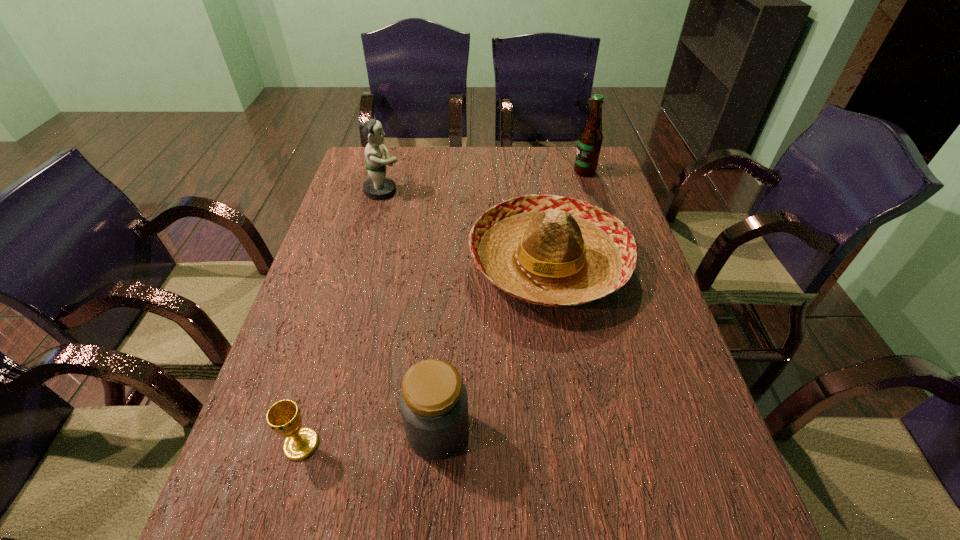
This screenshot has height=540, width=960. Find the location of `vacant space located 0.300m on the back of the sombrero`. vacant space located 0.300m on the back of the sombrero is located at coordinates (533, 164).

Find the location of a particular element. This screenshot has width=960, height=540. vacant region located 0.400m on the right of the chalice is located at coordinates (526, 444).

Find the location of a particular element. The height and width of the screenshot is (540, 960). beer bottle that is at the far edge is located at coordinates (590, 139).

Where is `figurine present at the far edge`? This screenshot has height=540, width=960. figurine present at the far edge is located at coordinates (378, 186).

Where is `figurine present at the left edge`? figurine present at the left edge is located at coordinates (378, 186).

Identify the location of chalice present at the left edge. Image resolution: width=960 pixels, height=540 pixels. (284, 417).

Where is `beer bottle that is at the right edge`? beer bottle that is at the right edge is located at coordinates click(590, 139).

You are a GUI agent. You are given a task and a screenshot of the screen. Output one action in this format:
    pyautogui.click(x=<x>, y=<y>)
    Task: Click on the sombrero at the right edge
    This screenshot has width=960, height=540.
    Given the screenshot: What is the action you would take?
    pyautogui.click(x=549, y=250)

At what (x,y) coordinates should I click in order to perform the action: click on object at the far left corner. Please return your answer as a coordinate pair (x, y). This screenshot has height=540, width=960. Looking at the image, I should click on (378, 186).

This screenshot has height=540, width=960. Identify the location of object that is at the far right corner. (590, 139).